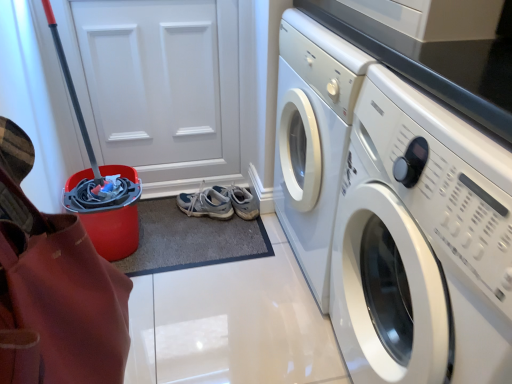
Question: Can we say white matte door at upper left lies outside light gray fabric running shoe at center?

Choices:
 (A) no
 (B) yes

Answer: (B)

Question: Does white matte door at upper left have a greater height compared to light gray fabric running shoe at center?

Choices:
 (A) yes
 (B) no

Answer: (A)

Question: Is white matte door at upper left thinner than light gray fabric running shoe at center?

Choices:
 (A) yes
 (B) no

Answer: (A)

Question: Is the depth of white matte door at upper left less than that of light gray fabric running shoe at center?

Choices:
 (A) no
 (B) yes

Answer: (B)

Question: Does white matte door at upper left have a lesser height compared to light gray fabric running shoe at center?

Choices:
 (A) no
 (B) yes

Answer: (A)

Question: Can you confirm if white matte door at upper left is smaller than light gray fabric running shoe at center?

Choices:
 (A) yes
 (B) no

Answer: (B)

Question: Can you confirm if white glossy washing machine at right is wider than white matte door at upper left?

Choices:
 (A) no
 (B) yes

Answer: (B)

Question: Does white glossy washing machine at right appear on the right side of white matte door at upper left?

Choices:
 (A) yes
 (B) no

Answer: (A)

Question: From the image's perspective, is white glossy washing machine at right beneath white matte door at upper left?

Choices:
 (A) yes
 (B) no

Answer: (A)

Question: Is white glossy washing machine at right thinner than white matte door at upper left?

Choices:
 (A) yes
 (B) no

Answer: (B)

Question: From a real-world perspective, is white glossy washing machine at right under white matte door at upper left?

Choices:
 (A) yes
 (B) no

Answer: (A)

Question: Is white glossy washing machine at right oriented towards white matte door at upper left?

Choices:
 (A) no
 (B) yes

Answer: (A)

Question: From a real-world perspective, is red plastic bucket at left located beneath light gray fabric running shoe at center?

Choices:
 (A) no
 (B) yes

Answer: (A)